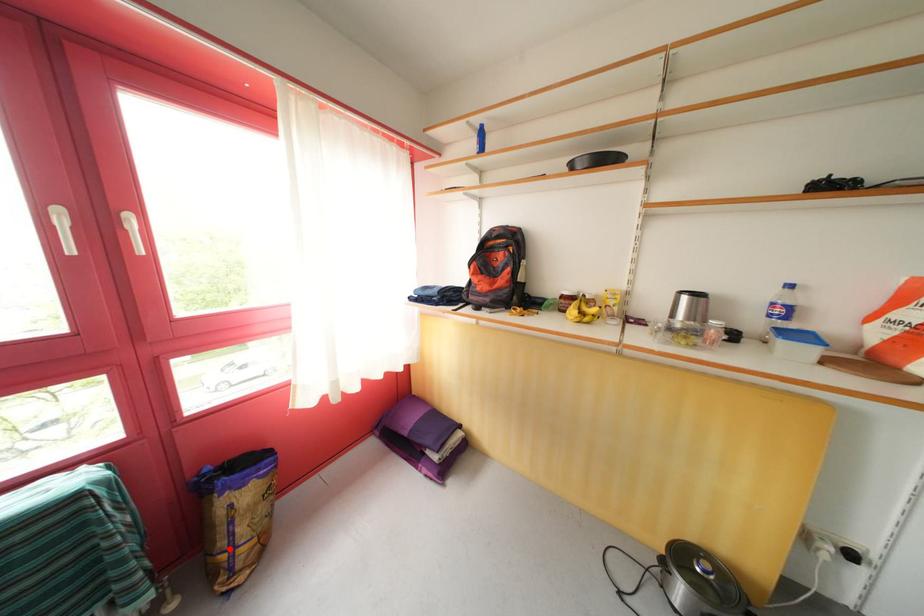
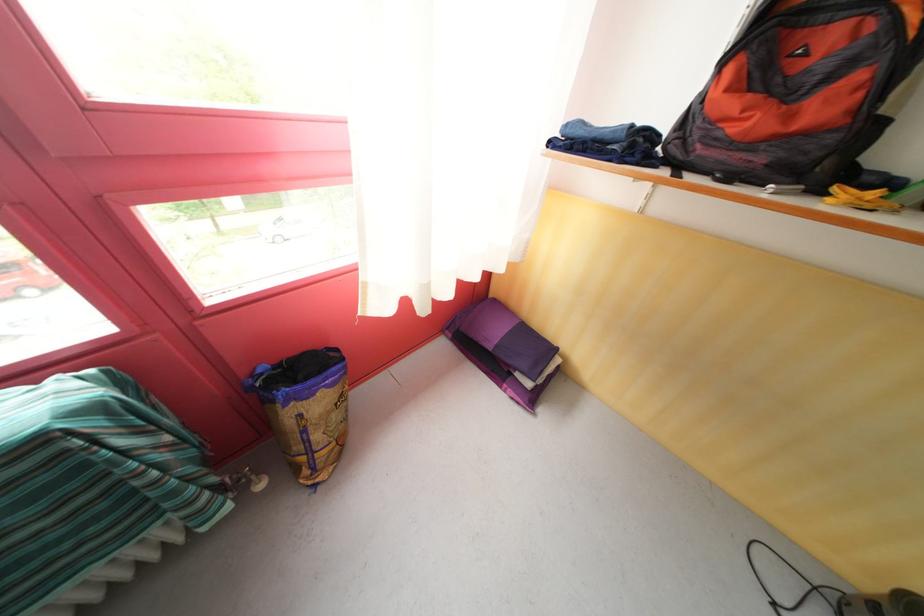
Question: I am providing you with two images of the same scene from different viewpoints. In image1, a red point is highlighted. Considering the same 3D point in image2, which of the following is correct?

Choices:
 (A) It is closer
 (B) It is farther

Answer: (B)